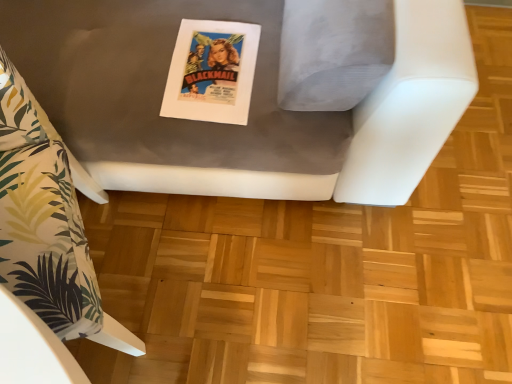
Identify the location of blank space situated above matte paper poster at center (from a real-world perspective). (216, 44).